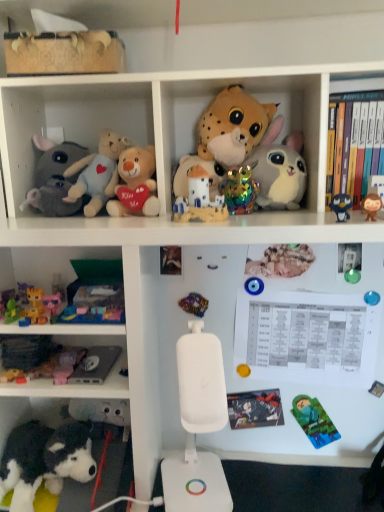
In order to face matte ceramic castle at center, which is counted as the eighth toy, starting from the left, should I rotate leftwards or rightwards?

Turn right by 0.742 degrees to look at matte ceramic castle at center, which is counted as the eighth toy, starting from the left.

What is the approximate width of matt black comic book at center, placed as the 2th book when sorted from right to left?

matt black comic book at center, placed as the 2th book when sorted from right to left, is 1.13 inches wide.

Describe the element at coordinates (357, 141) in the screenshot. I see `hardcover book at upper right, which is the second book in left-to-right order` at that location.

Identify the location of hardcover book at upper right, which appears as the first book when viewed from the top. The height and width of the screenshot is (512, 384). (357, 141).

Identify the location of multicolored beads at center, which ranks as the eighth toy in right-to-left order. (194, 304).

In order to face white plush rabbit at upper center, the fourth toy positioned from the right, should I rotate leftwards or rightwards?

It's best to rotate right around 11.012 degrees.

What do you see at coordinates (279, 169) in the screenshot? The height and width of the screenshot is (512, 384). I see `white plush rabbit at upper center, arranged as the 11th toy when viewed from the left` at bounding box center [279, 169].

Find the location of `green fabric plush at lower right, the 3th toy in the right-to-left sequence`. green fabric plush at lower right, the 3th toy in the right-to-left sequence is located at coordinates (314, 421).

Considering the points (366, 218) and (32, 190), which point is in front, point (366, 218) or point (32, 190)?

The point (366, 218) is closer to the camera.

Considering the positions of objects brown matte monkey at right, which ranks as the first toy in right-to-left order, and gray plush elephant at left, acting as the 12th toy starting from the right, in the image provided, who is more to the left, brown matte monkey at right, which ranks as the first toy in right-to-left order, or gray plush elephant at left, acting as the 12th toy starting from the right,?

gray plush elephant at left, acting as the 12th toy starting from the right, is more to the left.

In the scene shown: Is brown matte monkey at right, marked as the fourteenth toy in a left-to-right arrangement, placed right next to gray plush elephant at left, acting as the 12th toy starting from the right?

brown matte monkey at right, marked as the fourteenth toy in a left-to-right arrangement, and gray plush elephant at left, acting as the 12th toy starting from the right, are not in contact.

Does brown matte monkey at right, marked as the fourteenth toy in a left-to-right arrangement, come behind gray plush elephant at left, the 3th toy positioned from the left?

No, the depth of brown matte monkey at right, marked as the fourteenth toy in a left-to-right arrangement, is less than that of gray plush elephant at left, the 3th toy positioned from the left.

Is hardcover book at upper right, which ranks as the 1th book in right-to-left order, facing away from gray plush elephant at left, the 3th toy positioned from the left?

hardcover book at upper right, which ranks as the 1th book in right-to-left order, does not have its back to gray plush elephant at left, the 3th toy positioned from the left.

Would you say hardcover book at upper right, which ranks as the 1th book in right-to-left order, contains gray plush elephant at left, acting as the 12th toy starting from the right?

Actually, gray plush elephant at left, acting as the 12th toy starting from the right, is outside hardcover book at upper right, which ranks as the 1th book in right-to-left order.

Can you confirm if hardcover book at upper right, which ranks as the 1th book in right-to-left order, is wider than gray plush elephant at left, the 3th toy positioned from the left?

Incorrect, the width of hardcover book at upper right, which ranks as the 1th book in right-to-left order, does not surpass that of gray plush elephant at left, the 3th toy positioned from the left.

From the image's perspective, is hardcover book at upper right, which ranks as the second book in bottom-to-top order, positioned above or below gray plush elephant at left, the 3th toy positioned from the left?

From the image's perspective, hardcover book at upper right, which ranks as the second book in bottom-to-top order, appears above gray plush elephant at left, the 3th toy positioned from the left.

In the scene shown: Considering the positions of objects fluffy plush toys at left and pink plastic toy at lower left, the 10th toy positioned from the right, in the image provided, who is behind, fluffy plush toys at left or pink plastic toy at lower left, the 10th toy positioned from the right,?

pink plastic toy at lower left, the 10th toy positioned from the right, is more distant.

Find the location of a particular element. This screenshot has width=384, height=512. the 3rd toy behind the fluffy plush toys at left, counting from the anchor's position is located at coordinates (59, 365).

In terms of height, does fluffy plush toys at left look taller or shorter compared to pink plastic toy at lower left, positioned as the fifth toy in left-to-right order?

fluffy plush toys at left is taller than pink plastic toy at lower left, positioned as the fifth toy in left-to-right order.

From a real-world perspective, relative to matte ceramic castle at center, the 7th toy when ordered from right to left, is velvety plush bear at center left, the 9th toy when ordered from right to left, vertically above or below?

In terms of real-world spatial position, velvety plush bear at center left, the 9th toy when ordered from right to left, is above matte ceramic castle at center, the 7th toy when ordered from right to left.

Looking at this image, is velvety plush bear at center left, the sixth toy positioned from the left, touching matte ceramic castle at center, the 7th toy when ordered from right to left?

velvety plush bear at center left, the sixth toy positioned from the left, is not next to matte ceramic castle at center, the 7th toy when ordered from right to left, and they're not touching.

Can you confirm if velvety plush bear at center left, the 9th toy when ordered from right to left, is smaller than matte ceramic castle at center, which is counted as the eighth toy, starting from the left?

Actually, velvety plush bear at center left, the 9th toy when ordered from right to left, might be larger than matte ceramic castle at center, which is counted as the eighth toy, starting from the left.

How different are the orientations of velvety plush bear at center left, the 9th toy when ordered from right to left, and matte ceramic castle at center, which is counted as the eighth toy, starting from the left, in degrees?

They differ by 1.27 degrees in their facing directions.

Considering the relative sizes of spotted fur plush at center, positioned as the ninth toy in left-to-right order, and green plastic ball at upper right, the 13th toy viewed from the left, in the image provided, is spotted fur plush at center, positioned as the ninth toy in left-to-right order, wider than green plastic ball at upper right, the 13th toy viewed from the left,?

Indeed, spotted fur plush at center, positioned as the ninth toy in left-to-right order, has a greater width compared to green plastic ball at upper right, the 13th toy viewed from the left.

Can you confirm if spotted fur plush at center, which is the 6th toy from right to left, is positioned to the right of green plastic ball at upper right, the 13th toy viewed from the left?

Incorrect, spotted fur plush at center, which is the 6th toy from right to left, is not on the right side of green plastic ball at upper right, the 13th toy viewed from the left.

Is point (251, 130) closer or farther from the camera than point (349, 259)?

Point (251, 130) appears to be farther away from the viewer than point (349, 259).

Which object is further away from the camera, spotted fur plush at center, positioned as the ninth toy in left-to-right order, or velvety plush bear at center left, the 9th toy when ordered from right to left?

spotted fur plush at center, positioned as the ninth toy in left-to-right order, is further from the camera.

From a real-world perspective, which object rests below the other?

From a 3D spatial view, velvety plush bear at center left, the 9th toy when ordered from right to left, is below.

Considering the sizes of objects spotted fur plush at center, which is the 6th toy from right to left, and velvety plush bear at center left, the sixth toy positioned from the left, in the image provided, who is smaller, spotted fur plush at center, which is the 6th toy from right to left, or velvety plush bear at center left, the sixth toy positioned from the left,?

velvety plush bear at center left, the sixth toy positioned from the left.

From a real-world perspective, is green fabric plush at lower right, placed as the 12th toy when sorted from left to right, below pink plastic toy at lower left, the 10th toy positioned from the right?

Indeed, from a real-world perspective, green fabric plush at lower right, placed as the 12th toy when sorted from left to right, is positioned beneath pink plastic toy at lower left, the 10th toy positioned from the right.

Considering the relative sizes of green fabric plush at lower right, placed as the 12th toy when sorted from left to right, and pink plastic toy at lower left, the 10th toy positioned from the right, in the image provided, is green fabric plush at lower right, placed as the 12th toy when sorted from left to right, shorter than pink plastic toy at lower left, the 10th toy positioned from the right,?

In fact, green fabric plush at lower right, placed as the 12th toy when sorted from left to right, may be taller than pink plastic toy at lower left, the 10th toy positioned from the right.

Is green fabric plush at lower right, the 3th toy in the right-to-left sequence, not inside pink plastic toy at lower left, the 10th toy positioned from the right?

Yes.

Based on the photo, is green fabric plush at lower right, the 3th toy in the right-to-left sequence, touching pink plastic toy at lower left, the 10th toy positioned from the right?

No, green fabric plush at lower right, the 3th toy in the right-to-left sequence, is not with pink plastic toy at lower left, the 10th toy positioned from the right.

The height and width of the screenshot is (512, 384). I want to click on the 4th toy below when counting from the gray plush elephant at left, the 3th toy positioned from the left (from the image's perspective), so click(x=371, y=206).

There is a gray plush elephant at left, the 3th toy positioned from the left. Where is `book above it (from a real-world perspective)`? book above it (from a real-world perspective) is located at coordinates (357, 141).

Which object lies further to the anchor point pink plastic toy at lower left, the 10th toy positioned from the right, holographic plastic toy at center, arranged as the tenth toy when viewed from the left, or spotted fur plush at center, which is the 6th toy from right to left?

spotted fur plush at center, which is the 6th toy from right to left, lies further to pink plastic toy at lower left, the 10th toy positioned from the right, than the other object.

From the image, which object appears to be farther from velvety plush bear at center left, the 9th toy when ordered from right to left, green plastic toy at left, which is counted as the 13th toy, starting from the right, or black plush dog at lower left, which is counted as the fourth toy, starting from the left?

black plush dog at lower left, which is counted as the fourth toy, starting from the left, lies further to velvety plush bear at center left, the 9th toy when ordered from right to left, than the other object.

Based on their spatial positions, is fluffy plush toys at left or multicolored beads at center, the 7th toy positioned from the left, closer to green plastic ball at upper right, which ranks as the second toy in right-to-left order?

multicolored beads at center, the 7th toy positioned from the left, is closer to green plastic ball at upper right, which ranks as the second toy in right-to-left order.

Which object lies further to the anchor point pink plastic toy at lower left, positioned as the fifth toy in left-to-right order, hardcover book at upper right, which ranks as the second book in bottom-to-top order, or holographic plastic toy at center, arranged as the tenth toy when viewed from the left?

The object further to pink plastic toy at lower left, positioned as the fifth toy in left-to-right order, is hardcover book at upper right, which ranks as the second book in bottom-to-top order.

Looking at this image, which object lies nearer to the anchor point white plush rabbit at upper center, the fourth toy positioned from the right, green fabric plush at lower right, placed as the 12th toy when sorted from left to right, or multicolored beads at center, the 7th toy positioned from the left?

multicolored beads at center, the 7th toy positioned from the left, is closer to white plush rabbit at upper center, the fourth toy positioned from the right.

Looking at the image, which one is located further to pink plastic toy at lower left, the 10th toy positioned from the right, matt black comic book at center, the second book when ordered from top to bottom, or fluffy plush toys at left?

fluffy plush toys at left is further to pink plastic toy at lower left, the 10th toy positioned from the right.

Estimate the real-world distances between objects in this image. Which object is further from green plastic ball at upper right, which ranks as the second toy in right-to-left order, brown matte monkey at right, marked as the fourteenth toy in a left-to-right arrangement, or spotted fur plush at center, which is the 6th toy from right to left?

Based on the image, spotted fur plush at center, which is the 6th toy from right to left, appears to be further to green plastic ball at upper right, which ranks as the second toy in right-to-left order.

When comparing their distances from multicolored beads at center, which ranks as the eighth toy in right-to-left order, does green fabric plush at lower right, placed as the 12th toy when sorted from left to right, or gray plush elephant at left, the 3th toy positioned from the left, seem closer?

→ The object closer to multicolored beads at center, which ranks as the eighth toy in right-to-left order, is green fabric plush at lower right, placed as the 12th toy when sorted from left to right.

This screenshot has width=384, height=512. I want to click on shelf between green plastic toy at left, which is counted as the 13th toy, starting from the right, and multicolored beads at center, which ranks as the eighth toy in right-to-left order, so click(70, 118).

Locate an element on the screen. The width and height of the screenshot is (384, 512). shelf situated between gray plush elephant at left, acting as the 12th toy starting from the right, and velvety plush bear at center left, the 9th toy when ordered from right to left, from left to right is located at coordinates (70, 118).

The height and width of the screenshot is (512, 384). I want to click on shelf between yellow plush toy at lower left, the 1th toy positioned from the left, and brown matte monkey at right, marked as the fourteenth toy in a left-to-right arrangement, in the horizontal direction, so click(x=70, y=118).

Locate an element on the screen. Image resolution: width=384 pixels, height=512 pixels. book between spotted fur plush at center, positioned as the ninth toy in left-to-right order, and matt black comic book at center, placed as the 2th book when sorted from right to left, in the up-down direction is located at coordinates click(x=357, y=141).